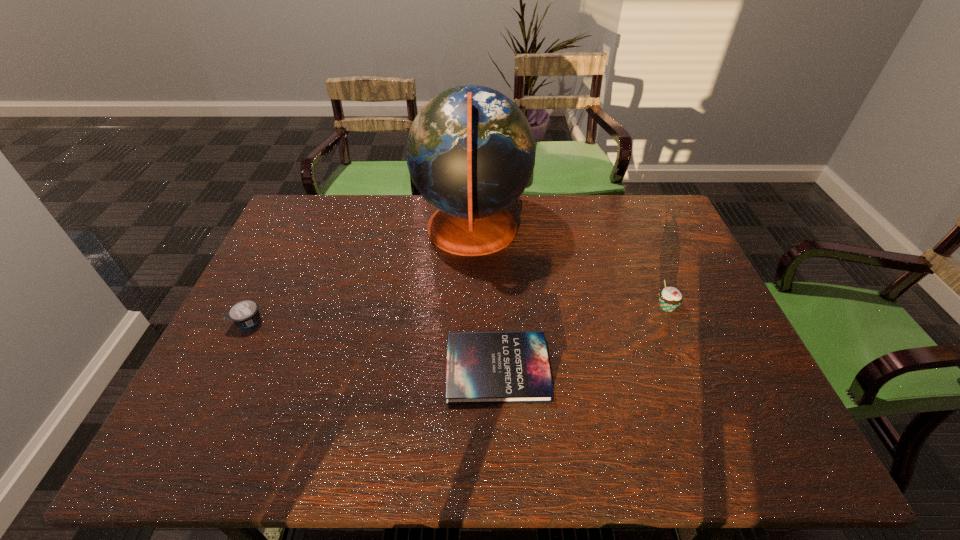
This screenshot has width=960, height=540. I want to click on free space located on the back of the second shortest object, so click(290, 236).

Where is `free space located 0.130m on the front of the shortest object`? This screenshot has width=960, height=540. free space located 0.130m on the front of the shortest object is located at coordinates (501, 462).

This screenshot has width=960, height=540. I want to click on object at the far edge, so click(470, 151).

What are the coordinates of `object at the left edge` in the screenshot? It's located at (245, 313).

Where is `object that is at the right edge`? The height and width of the screenshot is (540, 960). object that is at the right edge is located at coordinates (670, 298).

The width and height of the screenshot is (960, 540). What are the coordinates of `vacant area at the far edge` in the screenshot? It's located at (425, 214).

Image resolution: width=960 pixels, height=540 pixels. In the image, there is a desktop. Identify the location of vacant space at the near edge. (562, 425).

Locate an element on the screen. The width and height of the screenshot is (960, 540). free spot at the left edge of the desktop is located at coordinates (272, 303).

The height and width of the screenshot is (540, 960). Identify the location of free space at the right edge of the desktop. (705, 339).

The height and width of the screenshot is (540, 960). What are the coordinates of `free spot between the rightmost object and the tallest object` in the screenshot? It's located at (569, 268).